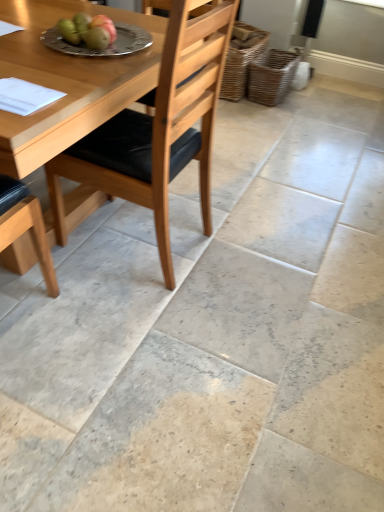
Locate an element on the screen. The width and height of the screenshot is (384, 512). free space to the left of green matte apple at upper left, which ranks as the first fruit in left-to-right order is located at coordinates (25, 36).